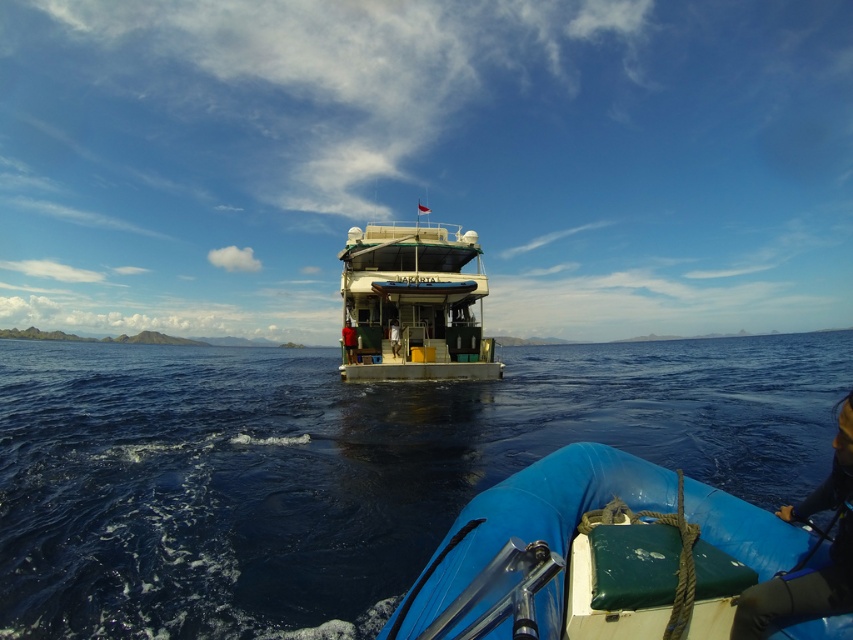
Question: Is blue water at center wider than white glossy boat at center?

Choices:
 (A) no
 (B) yes

Answer: (B)

Question: Which point is farther from the camera taking this photo?

Choices:
 (A) (432, 273)
 (B) (628, 433)
 (C) (798, 545)

Answer: (A)

Question: Is blue water at center bigger than blue rubber boat at lower center?

Choices:
 (A) no
 (B) yes

Answer: (B)

Question: Which point is closer to the camera?

Choices:
 (A) (86, 508)
 (B) (572, 497)
 (C) (347, 376)

Answer: (B)

Question: Among these objects, which one is nearest to the camera?

Choices:
 (A) white glossy boat at center
 (B) blue rubber boat at lower center
 (C) blue water at center

Answer: (B)

Question: Does blue water at center lie in front of blue rubber boat at lower center?

Choices:
 (A) yes
 (B) no

Answer: (B)